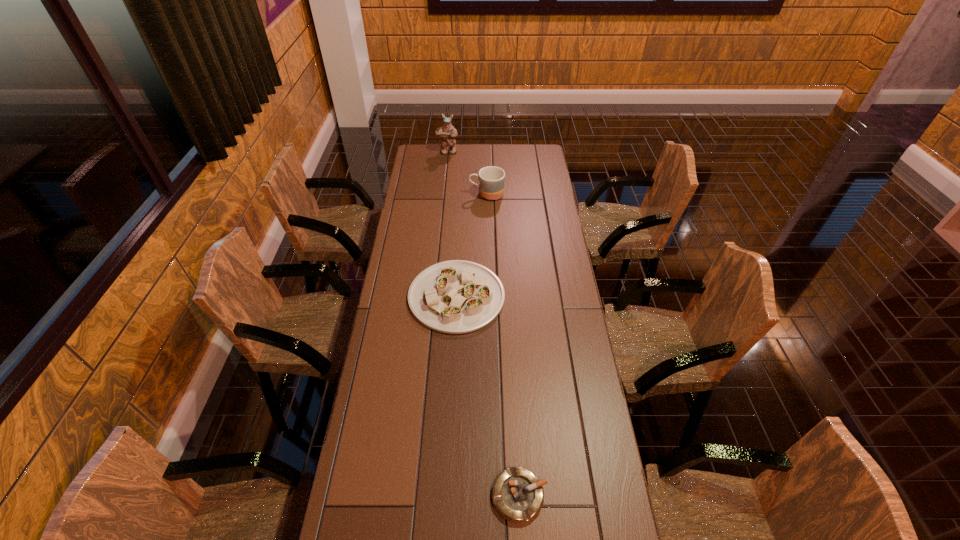
Locate which object is the closest to the platter. Please provide its 2D coordinates. Your answer should be formatted as a tuple, i.e. [(x, y)], where the tuple contains the x and y coordinates of a point satisfying the conditions above.

[(491, 179)]

Find the location of a particular element. the second closest object to the third shortest object is located at coordinates (456, 296).

At what (x,y) coordinates should I click in order to perform the action: click on blank space that satisfies the following two spatial constraints: 1. on the side with the handle of the third shortest object; 2. on the back side of the ashtray. Please return your answer as a coordinate pair (x, y). The width and height of the screenshot is (960, 540). Looking at the image, I should click on (492, 496).

Identify the location of free space that satisfies the following two spatial constraints: 1. on the front-facing side of the figurine; 2. on the right side of the second nearest object. (434, 296).

Identify the location of vacant area in the image that satisfies the following two spatial constraints: 1. on the side with the handle of the ashtray; 2. on the right side of the second farthest object. The image size is (960, 540). (492, 496).

Where is `vacant area that satisfies the following two spatial constraints: 1. on the side with the handle of the mug; 2. on the back side of the nearest object`? The image size is (960, 540). vacant area that satisfies the following two spatial constraints: 1. on the side with the handle of the mug; 2. on the back side of the nearest object is located at coordinates (492, 496).

Identify the location of free space that satisfies the following two spatial constraints: 1. on the front-facing side of the figurine; 2. on the left side of the third farthest object. (434, 296).

Image resolution: width=960 pixels, height=540 pixels. I want to click on free spot that satisfies the following two spatial constraints: 1. on the front-facing side of the third tallest object; 2. on the left side of the figurine, so click(x=434, y=296).